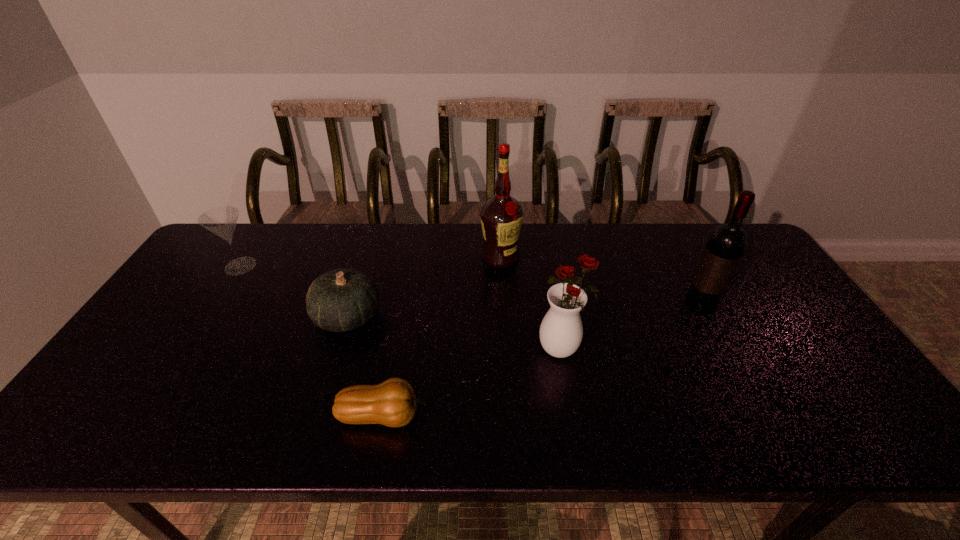
Locate an element on the screen. The image size is (960, 540). vacant space located on the label of the fourth object from left to right is located at coordinates (503, 310).

You are a GUI agent. You are given a task and a screenshot of the screen. Output one action in this format:
    pyautogui.click(x=<x>, y=<y>)
    Task: Click on the blank area located 0.280m on the left of the wine bottle
    
    Given the screenshot: What is the action you would take?
    pyautogui.click(x=587, y=306)

The height and width of the screenshot is (540, 960). I want to click on vacant region located 0.200m on the left of the second object from right to left, so click(461, 349).

You are a GUI agent. You are given a task and a screenshot of the screen. Output one action in this format:
    pyautogui.click(x=<x>, y=<y>)
    Task: Click on the blank space located 0.390m on the right of the flute glass
    
    Given the screenshot: What is the action you would take?
    pyautogui.click(x=381, y=266)

You are a GUI agent. You are given a task and a screenshot of the screen. Output one action in this format:
    pyautogui.click(x=<x>, y=<y>)
    Task: Click on the free location located 0.080m on the right of the taller gourd
    
    Given the screenshot: What is the action you would take?
    pyautogui.click(x=410, y=316)

The width and height of the screenshot is (960, 540). I want to click on vacant area located 0.290m on the stem side of the shorter gourd, so click(x=558, y=416).

Where is `alcohol that is positioned at the far edge`? This screenshot has height=540, width=960. alcohol that is positioned at the far edge is located at coordinates (501, 216).

Image resolution: width=960 pixels, height=540 pixels. I want to click on flute glass located at the far edge, so click(221, 221).

Where is `object positioned at the near edge`? The height and width of the screenshot is (540, 960). object positioned at the near edge is located at coordinates (392, 403).

Locate an element on the screen. object situated at the left edge is located at coordinates (221, 221).